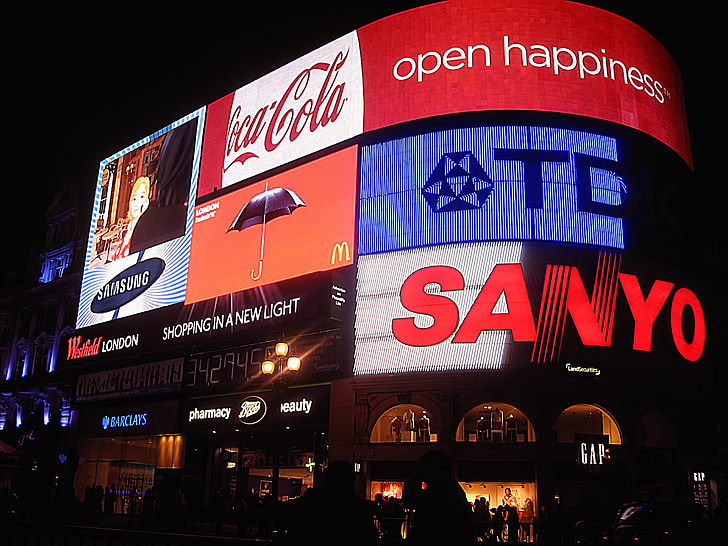
The height and width of the screenshot is (546, 728). What are the coordinates of `fan` in the screenshot? It's located at (309, 466).